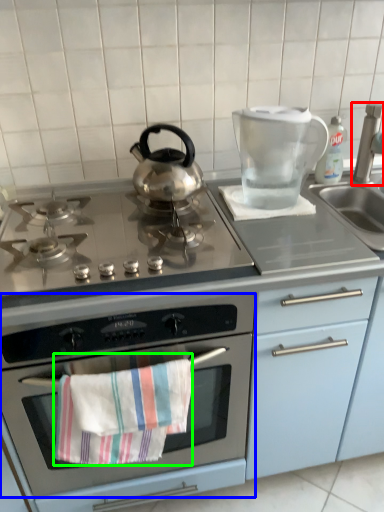
Question: Estimate the real-world distances between objects in this image. Which object is farther from faucet (highlighted by a red box), oven (highlighted by a blue box) or beach towel (highlighted by a green box)?

Choices:
 (A) oven
 (B) beach towel

Answer: (B)